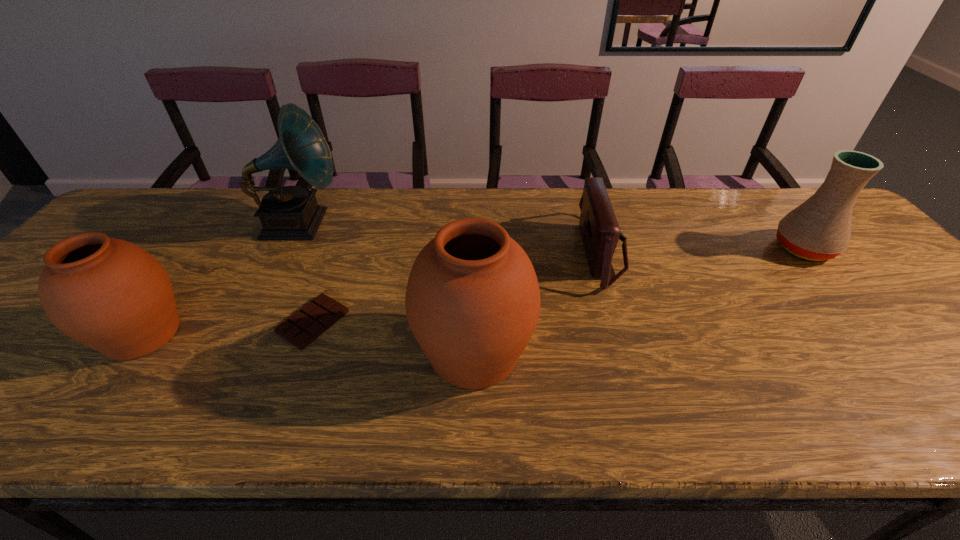
This screenshot has width=960, height=540. What are the coordinates of `free region located from the horn of the phonograph_record` in the screenshot? It's located at (383, 224).

Identify the location of free space located 0.250m on the front flap of the shoulder bag. (488, 251).

What are the coordinates of `free space located on the front flap of the shoulder bag` in the screenshot? It's located at (459, 251).

This screenshot has width=960, height=540. What are the coordinates of `blank area located 0.370m on the front flap of the shoulder bag` in the screenshot? It's located at (444, 251).

Identify the location of free spot located on the left of the pottery. The image size is (960, 540). (719, 248).

Where is `vacant space located on the left of the shortest object`? vacant space located on the left of the shortest object is located at coordinates (146, 322).

Where is `phonograph_record that is at the far edge`? Image resolution: width=960 pixels, height=540 pixels. phonograph_record that is at the far edge is located at coordinates (291, 212).

Where is `shoulder bag that is at the far edge`? Image resolution: width=960 pixels, height=540 pixels. shoulder bag that is at the far edge is located at coordinates (600, 231).

The width and height of the screenshot is (960, 540). I want to click on pottery that is at the far edge, so click(819, 229).

Locate an element on the screen. The height and width of the screenshot is (540, 960). object at the right edge is located at coordinates tap(819, 229).